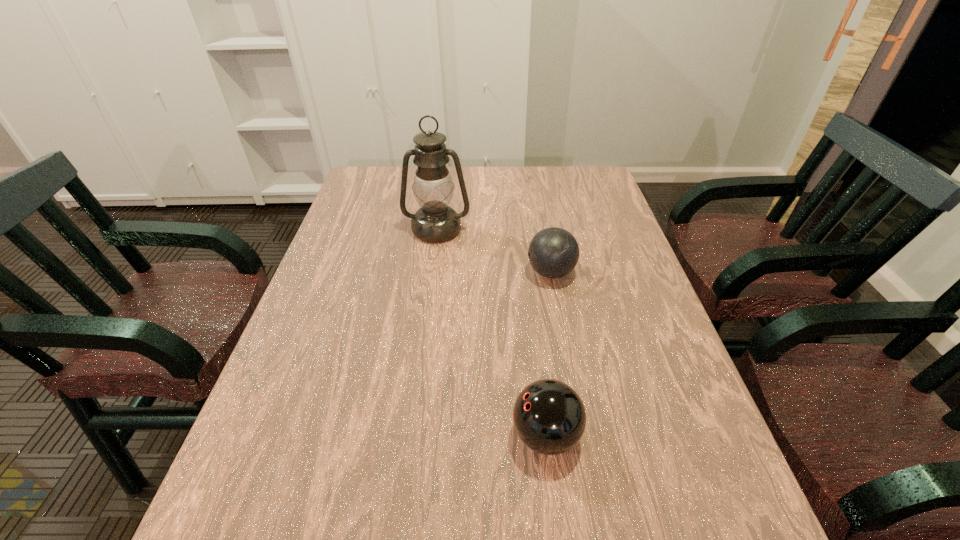
Locate an element on the screen. The width and height of the screenshot is (960, 540). vacant space located on the surface of the nearest object near the finger holes is located at coordinates (463, 435).

In the image, there is a desktop. At what (x,y) coordinates should I click in order to perform the action: click on vacant area at the left edge. Please return your answer as a coordinate pair (x, y). Looking at the image, I should click on 370,230.

The width and height of the screenshot is (960, 540). Identify the location of vacant point at the right edge. coord(629,335).

Image resolution: width=960 pixels, height=540 pixels. In the image, there is a desktop. What are the coordinates of `vacant space at the far left corner` in the screenshot? It's located at (373, 177).

I want to click on free space at the far right corner, so click(x=555, y=167).

The image size is (960, 540). Identify the location of vacant area that lies between the nearer bowling ball and the leftmost object. (492, 333).

Locate an element on the screen. This screenshot has height=540, width=960. empty space that is in between the nearest object and the farther bowling ball is located at coordinates (548, 354).

What are the coordinates of `vacant space in between the oil lamp and the farther bowling ball` in the screenshot? It's located at (493, 251).

Where is `free spot between the second farthest object and the farthest object`? Image resolution: width=960 pixels, height=540 pixels. free spot between the second farthest object and the farthest object is located at coordinates (493, 251).

Locate an element on the screen. vacant area between the nearer bowling ball and the farther bowling ball is located at coordinates (548, 354).